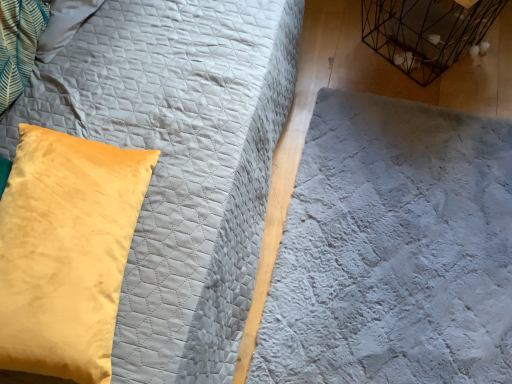
The image size is (512, 384). I want to click on white quilted fabric at center, so click(393, 250).

Locate an element on the screen. The width and height of the screenshot is (512, 384). velvet yellow pillow at left is located at coordinates (66, 251).

Locate an element on the screen. The image size is (512, 384). black wire birdcage at upper right is located at coordinates (426, 32).

Looking at this image, between velvet yellow pillow at left and black wire birdcage at upper right, which one has smaller width?

Thinner between the two is black wire birdcage at upper right.

From a real-world perspective, is velvet yellow pillow at left positioned above or below black wire birdcage at upper right?

velvet yellow pillow at left is situated higher than black wire birdcage at upper right in the real world.

Locate an element on the screen. The height and width of the screenshot is (384, 512). bird cage that appears on the right of velvet yellow pillow at left is located at coordinates (426, 32).

Which of these two, velvet yellow pillow at left or black wire birdcage at upper right, is bigger?

Bigger between the two is velvet yellow pillow at left.

Is black wire birdcage at upper right oriented away from velvet yellow pillow at left?

black wire birdcage at upper right is not turned away from velvet yellow pillow at left.

Considering the positions of objects black wire birdcage at upper right and velvet yellow pillow at left in the image provided, who is in front, black wire birdcage at upper right or velvet yellow pillow at left?

velvet yellow pillow at left is more forward.

Is black wire birdcage at upper right shorter than velvet yellow pillow at left?

Yes, black wire birdcage at upper right is shorter than velvet yellow pillow at left.

Does black wire birdcage at upper right touch velvet yellow pillow at left?

black wire birdcage at upper right and velvet yellow pillow at left are clearly separated.

Could you tell me if white quilted fabric at center is facing velvet yellow pillow at left?

No, white quilted fabric at center is not aimed at velvet yellow pillow at left.

Is white quilted fabric at center further to the viewer compared to velvet yellow pillow at left?

Yes, white quilted fabric at center is further from the camera.

From a real-world perspective, between white quilted fabric at center and velvet yellow pillow at left, who is vertically higher?

velvet yellow pillow at left, from a real-world perspective.

From the image's perspective, between velvet yellow pillow at left and white quilted fabric at center, who is located below?

From the image's view, velvet yellow pillow at left is below.

Relative to white quilted fabric at center, is velvet yellow pillow at left in front or behind?

Clearly, velvet yellow pillow at left is in front of white quilted fabric at center.

From a real-world perspective, relative to white quilted fabric at center, is velvet yellow pillow at left vertically above or below?

velvet yellow pillow at left is above white quilted fabric at center.

What's the angular difference between black wire birdcage at upper right and white quilted fabric at center's facing directions?

32.3 degrees.

Considering the relative positions of black wire birdcage at upper right and white quilted fabric at center in the image provided, is black wire birdcage at upper right to the left or to the right of white quilted fabric at center?

Clearly, black wire birdcage at upper right is on the right of white quilted fabric at center in the image.

Based on the photo, from the image's perspective, is black wire birdcage at upper right located above or below white quilted fabric at center?

black wire birdcage at upper right is above white quilted fabric at center.

How distant is black wire birdcage at upper right from white quilted fabric at center?

black wire birdcage at upper right is 19.13 inches from white quilted fabric at center.

The height and width of the screenshot is (384, 512). I want to click on bird cage on the right of white quilted fabric at center, so click(x=426, y=32).

Is white quilted fabric at center in contact with black wire birdcage at upper right?

No, white quilted fabric at center is not making contact with black wire birdcage at upper right.

Based on the photo, is black wire birdcage at upper right surrounded by white quilted fabric at center?

Actually, black wire birdcage at upper right is outside white quilted fabric at center.

The width and height of the screenshot is (512, 384). I want to click on pillow lying in front of the black wire birdcage at upper right, so click(66, 251).

Find the location of a particular element. Image resolution: width=512 pixels, height=384 pixels. pillow below the black wire birdcage at upper right (from the image's perspective) is located at coordinates (66, 251).

Looking at the image, which one is located further to velvet yellow pillow at left, black wire birdcage at upper right or white quilted fabric at center?

black wire birdcage at upper right is further to velvet yellow pillow at left.

Looking at the image, which one is located further to black wire birdcage at upper right, white quilted fabric at center or velvet yellow pillow at left?

The object further to black wire birdcage at upper right is velvet yellow pillow at left.

Looking at the image, which one is located further to velvet yellow pillow at left, white quilted fabric at center or black wire birdcage at upper right?

Among the two, black wire birdcage at upper right is located further to velvet yellow pillow at left.

Which object lies further to the anchor point black wire birdcage at upper right, velvet yellow pillow at left or white quilted fabric at center?

velvet yellow pillow at left lies further to black wire birdcage at upper right than the other object.

Consider the image. When comparing their distances from white quilted fabric at center, does velvet yellow pillow at left or black wire birdcage at upper right seem closer?

Based on the image, black wire birdcage at upper right appears to be nearer to white quilted fabric at center.

When comparing their distances from white quilted fabric at center, does black wire birdcage at upper right or velvet yellow pillow at left seem further?

velvet yellow pillow at left is positioned further to the anchor white quilted fabric at center.

You are a GUI agent. You are given a task and a screenshot of the screen. Output one action in this format:
    pyautogui.click(x=<x>, y=<y>)
    Task: Click on the sheet located between velvet yellow pillow at left and black wire birdcage at upper right in the left-right direction
    This screenshot has height=384, width=512.
    Given the screenshot: What is the action you would take?
    pyautogui.click(x=393, y=250)